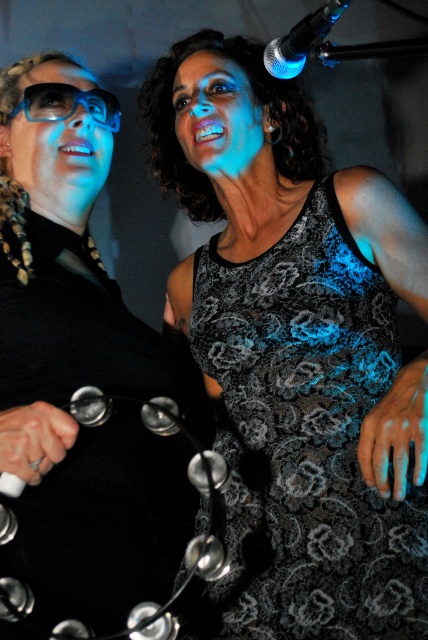
Is black lace dress at center to the right of matte black glasses at left from the viewer's perspective?

Correct, you'll find black lace dress at center to the right of matte black glasses at left.

How far apart are black lace dress at center and matte black glasses at left?

23.02 inches

The height and width of the screenshot is (640, 428). Describe the element at coordinates (305, 442) in the screenshot. I see `black lace dress at center` at that location.

Locate an element on the screen. The image size is (428, 640). black lace dress at center is located at coordinates pos(305,442).

Is point (104, 576) positioned before point (88, 93)?

Yes, point (104, 576) is in front of point (88, 93).

Is point (29, 372) behind point (56, 113)?

No, (29, 372) is closer to viewer.

This screenshot has height=640, width=428. Identify the location of black lace dress at upper right. (80, 368).

Does black lace dress at upper right have a larger size compared to black lace dress at center?

Yes, black lace dress at upper right is bigger than black lace dress at center.

Who is more distant from viewer, (62, 608) or (323, 371)?

Positioned behind is point (323, 371).

Image resolution: width=428 pixels, height=640 pixels. Find the location of `black lace dress at upper right`. black lace dress at upper right is located at coordinates (80, 368).